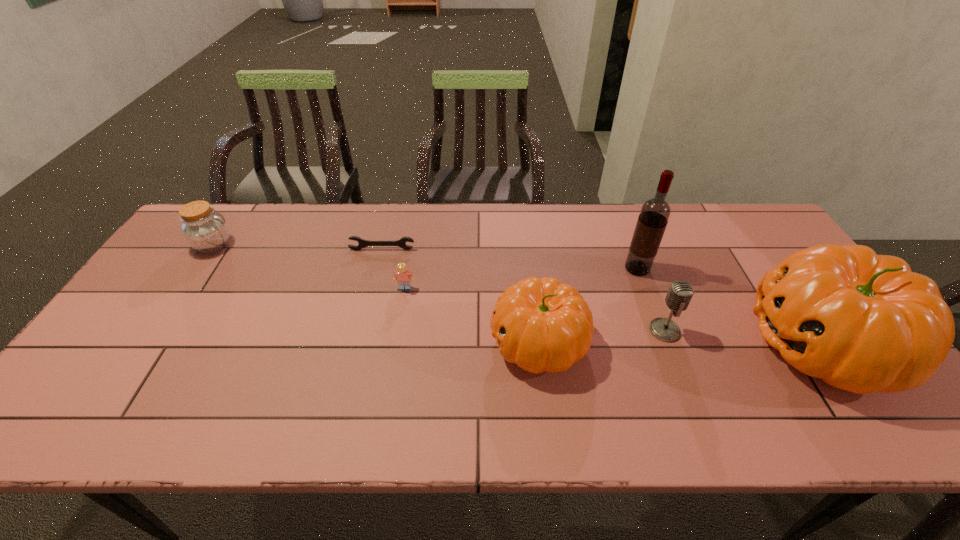
At what (x,y) coordinates should I click in order to perform the action: click on microphone. Please return your answer as a coordinate pair (x, y). Looking at the image, I should click on (680, 293).

Where is `free location located 0.310m on the carved face of the left pumpkin`? The width and height of the screenshot is (960, 540). free location located 0.310m on the carved face of the left pumpkin is located at coordinates (367, 342).

Where is `free space located on the carved face of the left pumpkin`? free space located on the carved face of the left pumpkin is located at coordinates (414, 342).

The width and height of the screenshot is (960, 540). What are the coordinates of `free region located 0.090m on the carved face of the left pumpkin` in the screenshot? It's located at (454, 342).

Where is `free space located 0.390m on the carved face of the rightmost object`? This screenshot has height=540, width=960. free space located 0.390m on the carved face of the rightmost object is located at coordinates (592, 343).

At what (x,y) coordinates should I click in order to perform the action: click on vacant region located on the carved face of the rightmost object. Please return your answer as a coordinate pair (x, y). Looking at the image, I should click on (668, 343).

Identify the location of blank space located on the carved face of the rightmost object. (652, 343).

Identify the location of vacant region located on the front of the leftmost object. This screenshot has width=960, height=540. (150, 340).

Locate an element on the screen. The width and height of the screenshot is (960, 540). vacant space located 0.140m on the right of the wine bottle is located at coordinates (697, 269).

You are a GUI agent. You are given a task and a screenshot of the screen. Output one action in this format:
    pyautogui.click(x=<x>, y=<y>)
    Task: Click on the vacant area situated 0.140m on the front-facing side of the second shortest object
    
    Given the screenshot: What is the action you would take?
    pyautogui.click(x=397, y=330)